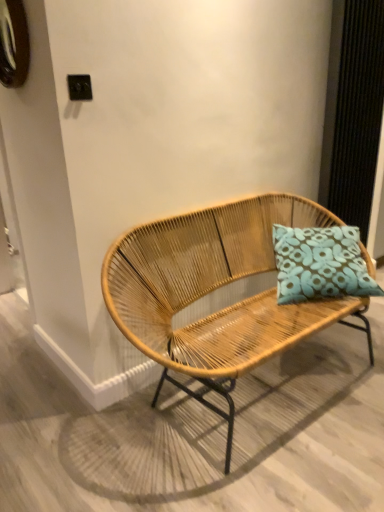
Question: Does point (241, 260) appear closer or farther from the camera than point (11, 50)?

Choices:
 (A) closer
 (B) farther

Answer: (B)

Question: Would you say natural wood bench at center is inside or outside brushed metal clock at upper left?

Choices:
 (A) outside
 (B) inside

Answer: (A)

Question: Which of these objects is positioned closest to the teal fabric pillow at center?

Choices:
 (A) brushed metal clock at upper left
 (B) natural wood bench at center

Answer: (B)

Question: Which object is positioned closest to the natural wood bench at center?

Choices:
 (A) teal fabric pillow at center
 (B) brushed metal clock at upper left

Answer: (A)